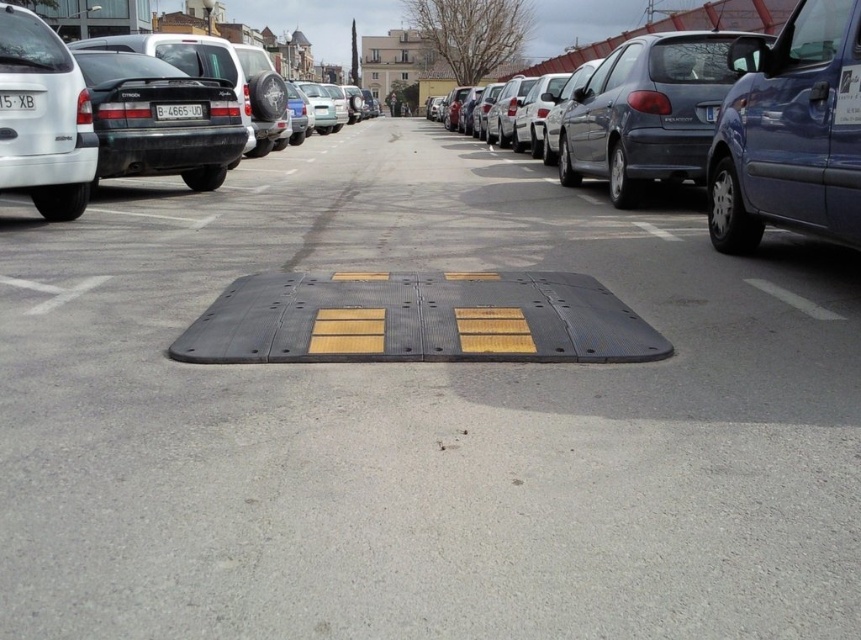
Question: Considering the real-world distances, which object is closest to the white asphalt at lower left?

Choices:
 (A) blue metallic van at right
 (B) matte blue hatchback at right
 (C) yellow matte license plate at center

Answer: (C)

Question: Can you confirm if blue metallic van at right is thinner than white plastic license plate at right?

Choices:
 (A) no
 (B) yes

Answer: (A)

Question: Observing the image, what is the correct spatial positioning of matte blue hatchback at right in reference to matte black car at left?

Choices:
 (A) above
 (B) below

Answer: (B)

Question: Among these objects, which one is nearest to the camera?

Choices:
 (A) yellow matte license plate at center
 (B) white plastic license plate at center
 (C) matte black car at left

Answer: (B)

Question: Which point is closer to the camera?

Choices:
 (A) (36, 285)
 (B) (14, 108)
 (C) (48, 291)

Answer: (C)

Question: Does matte black car at left appear over white asphalt at lower left?

Choices:
 (A) no
 (B) yes

Answer: (B)